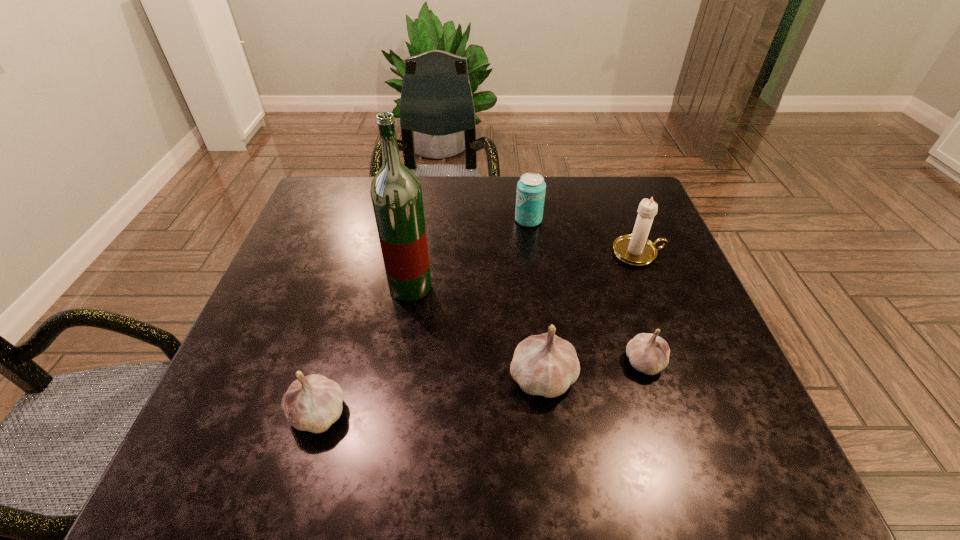
Locate an element on the screen. vacant region that satisfies the following two spatial constraints: 1. on the front side of the rightmost garlic; 2. on the left side of the third farthest object is located at coordinates (398, 362).

I want to click on vacant space that satisfies the following two spatial constraints: 1. on the handle side of the candle holder; 2. on the front side of the second garlic from left to right, so click(687, 377).

Locate an element on the screen. Image resolution: width=960 pixels, height=540 pixels. vacant space that satisfies the following two spatial constraints: 1. on the handle side of the fifth nearest object; 2. on the front side of the shortest garlic is located at coordinates (682, 362).